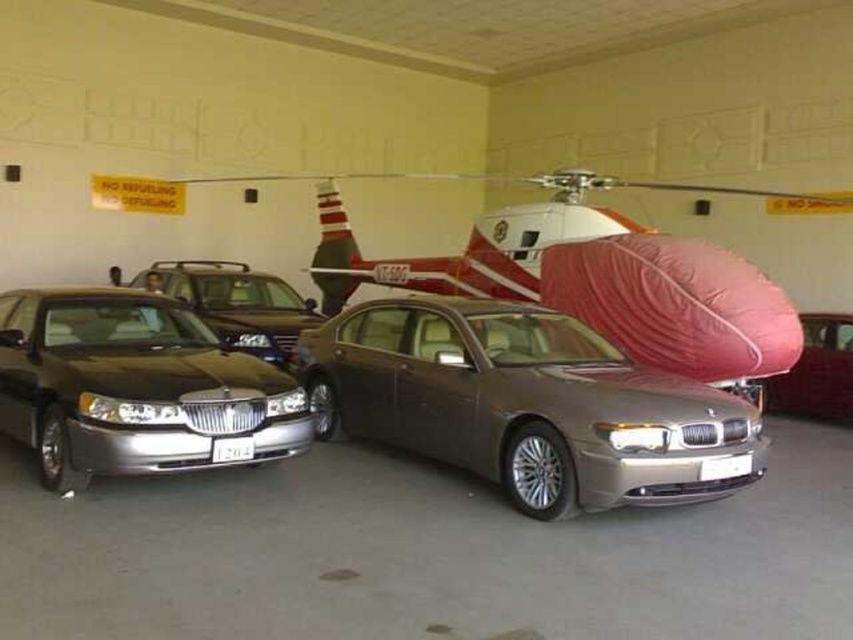
Find the location of a particular element. Image resolution: width=853 pixels, height=640 pixels. red fabric-covered airplane at center is located at coordinates (584, 273).

Is red fabric-covered airplane at center to the right of satin silver sedan at center from the viewer's perspective?

No, red fabric-covered airplane at center is not to the right of satin silver sedan at center.

I want to click on red fabric-covered airplane at center, so click(584, 273).

Who is positioned more to the right, satin metallic sedan at center or red fabric-covered airplane at center?

Positioned to the right is red fabric-covered airplane at center.

Is satin metallic sedan at center taller than red fabric-covered airplane at center?

In fact, satin metallic sedan at center may be shorter than red fabric-covered airplane at center.

Who is more distant from viewer, (x=680, y=433) or (x=567, y=220)?

Point (x=567, y=220)

I want to click on satin metallic sedan at center, so click(526, 404).

Between satin metallic sedan at center and satin silver sedan at center, which one is positioned lower?

satin silver sedan at center is below.

Where is `satin metallic sedan at center`? The height and width of the screenshot is (640, 853). satin metallic sedan at center is located at coordinates (526, 404).

Locate an element on the screen. satin metallic sedan at center is located at coordinates (526, 404).